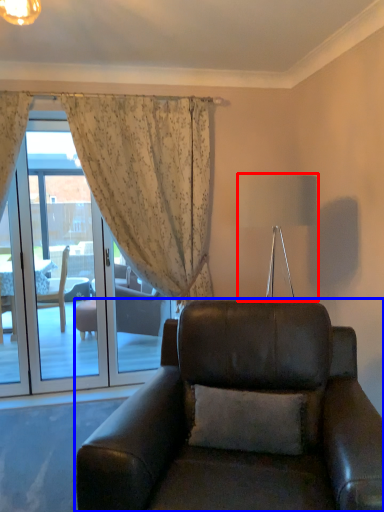
Question: Which object appears farthest to the camera in this image, lamp (highlighted by a red box) or chair (highlighted by a blue box)?

Choices:
 (A) lamp
 (B) chair

Answer: (A)